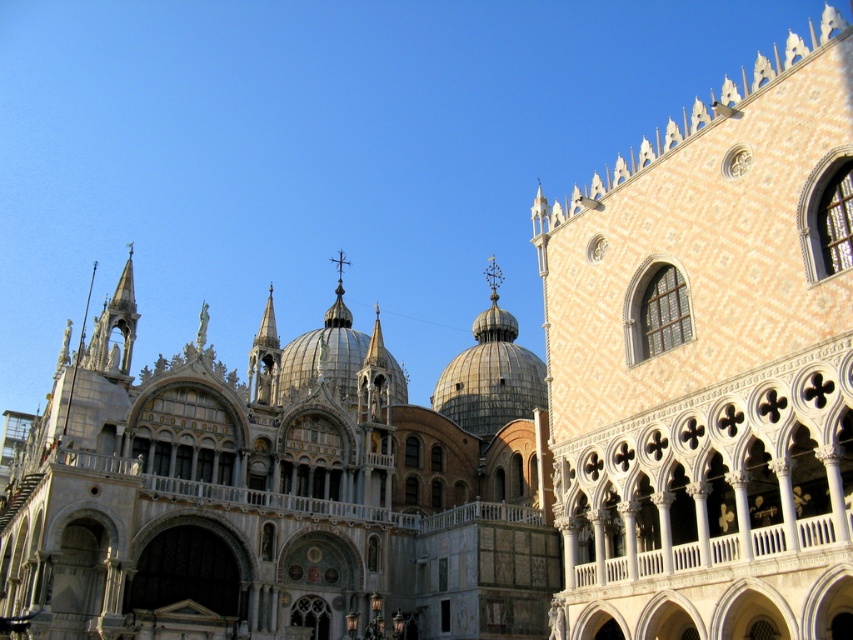
You are an architect analyzing the spatial relationships in this Venetian scene. Given the white textured building at upper right and the white marble church at center, which one appears larger in the image?

The white marble church at center appears larger than the white textured building at upper right because the description states that the white textured building at upper right has a smaller size compared to the white marble church at center.

You are an architect analyzing the spatial layout of this Venetian scene. Given that the white marble church at center is a key landmark, how does the width of the white textured building at upper right compare to it?

The white textured building at upper right has a lesser width compared to the white marble church at center, making the church appear more expansive in this architectural composition.

You are an architect analyzing the spatial arrangement of the buildings in this Venetian scene. Based on the image, which of the two landmarks, the white textured building at upper right or the white marble church at center, is positioned lower in the scene?

The white textured building at upper right is located below the white marble church at center, so it is positioned lower in the scene.